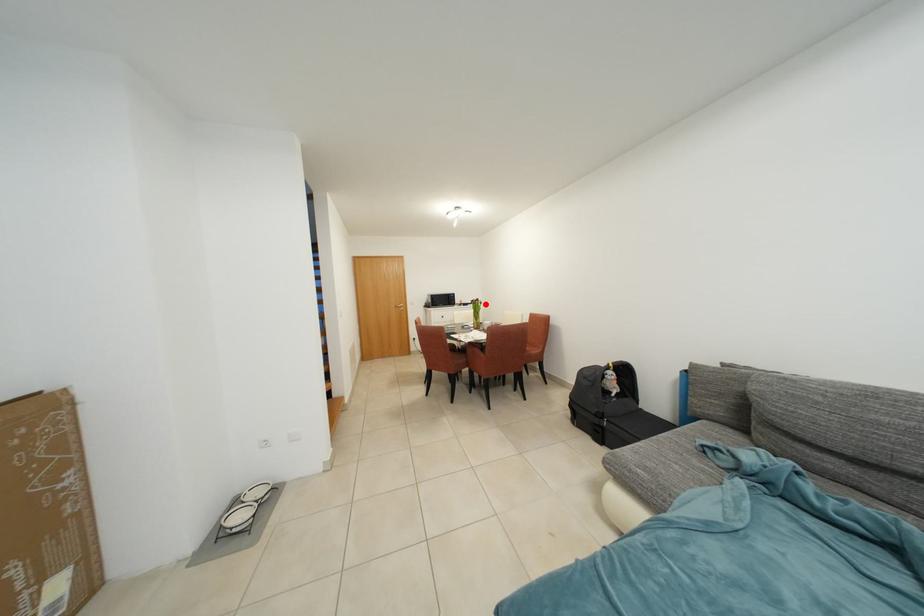
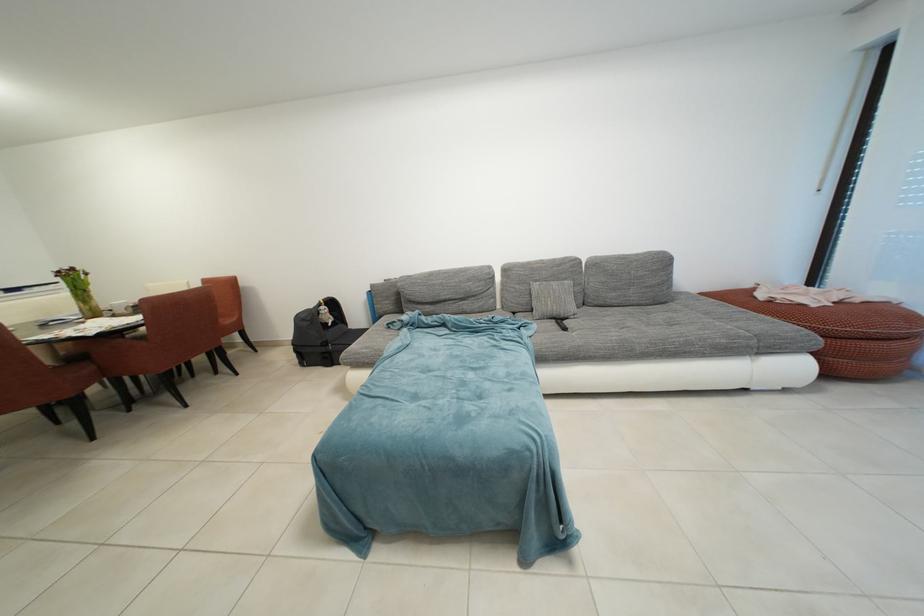
Find the pixel in the second image that matches the highlighted location in the first image.

(81, 274)